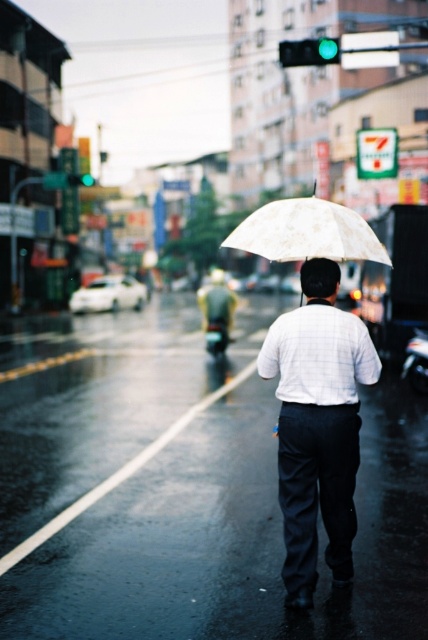
Question: Where is white checkered shirt at center located in relation to white floral-patterned umbrella at center in the image?

Choices:
 (A) below
 (B) above

Answer: (A)

Question: Is white checkered shirt at center further to camera compared to white floral-patterned umbrella at center?

Choices:
 (A) yes
 (B) no

Answer: (A)

Question: Does white checkered shirt at center appear under white floral-patterned umbrella at center?

Choices:
 (A) no
 (B) yes

Answer: (B)

Question: Which object appears farthest from the camera in this image?

Choices:
 (A) white floral-patterned umbrella at center
 (B) white checkered shirt at center

Answer: (B)